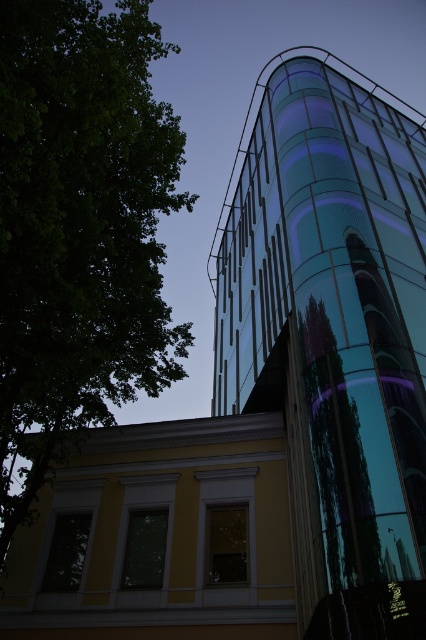
You are an architect analyzing the spatial relationship between the transparent glass tower at upper right and the green leafy tree at left. Based on the scene, which object is closer to the observer?

The transparent glass tower at upper right is closer to the observer because the green leafy tree at left is positioned behind it.

You are standing in the middle of the image and looking towards the two points marked as point (x=331, y=550) and point (x=3, y=541). Which point is closer to your viewpoint?

Point (x=331, y=550) is in front of point (x=3, y=541), so it is closer to your viewpoint.